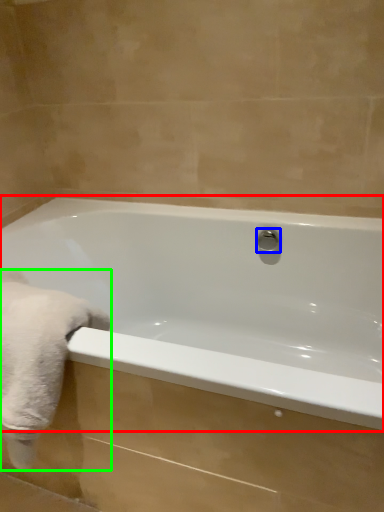
Question: Which object is the farthest from bathtub (highlighted by a red box)? Choose among these: shower (highlighted by a blue box) or bath towel (highlighted by a green box).

Choices:
 (A) shower
 (B) bath towel

Answer: (B)